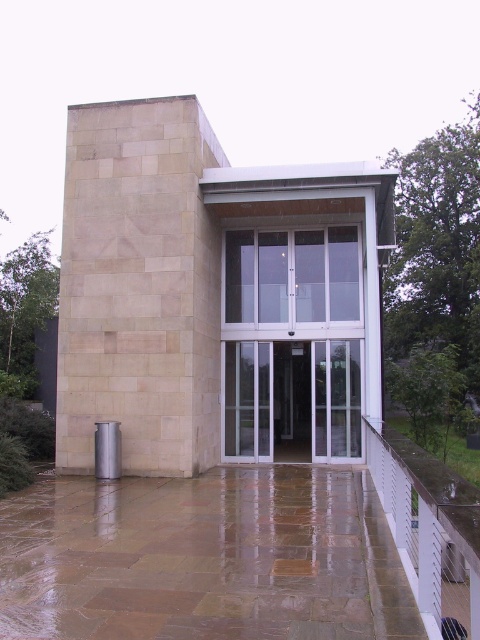
Question: Observing the image, what is the correct spatial positioning of beige stone pillar at left in reference to transparent glass door at center?

Choices:
 (A) right
 (B) left

Answer: (B)

Question: In this image, where is beige stone pillar at left located relative to satin silver cylinder at lower left?

Choices:
 (A) right
 (B) left

Answer: (B)

Question: Which of these objects is positioned farthest from the satin silver cylinder at lower left?

Choices:
 (A) beige stone pillar at left
 (B) transparent glass door at center

Answer: (B)

Question: Which point is farther from the camera taking this photo?

Choices:
 (A) (95, 436)
 (B) (360, 408)
 (C) (120, 381)

Answer: (B)

Question: Which point is closer to the camera taking this photo?

Choices:
 (A) (314, 364)
 (B) (122, 385)
 (C) (111, 458)

Answer: (C)

Question: Where is beige stone pillar at left located in relation to satin silver cylinder at lower left in the image?

Choices:
 (A) left
 (B) right

Answer: (A)